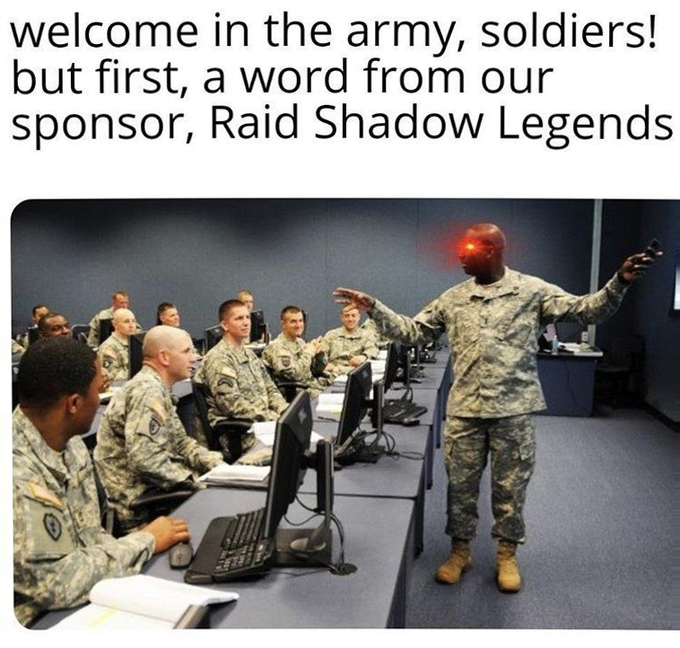
This screenshot has height=648, width=680. I want to click on computer mouse, so 177,551.